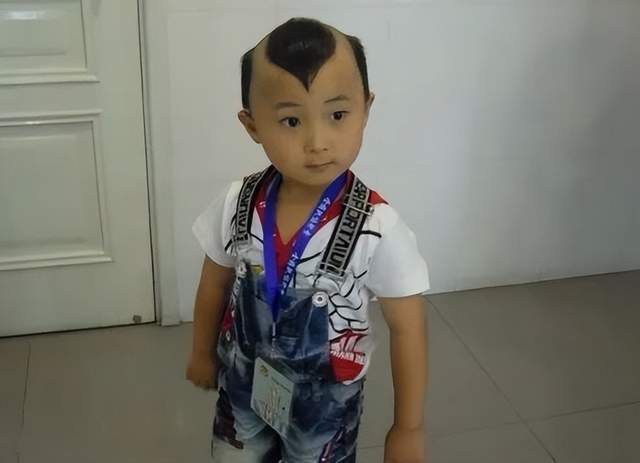
The image size is (640, 463). I want to click on floor tiles, so click(x=564, y=358), click(x=579, y=436), click(x=467, y=385), click(x=493, y=448).